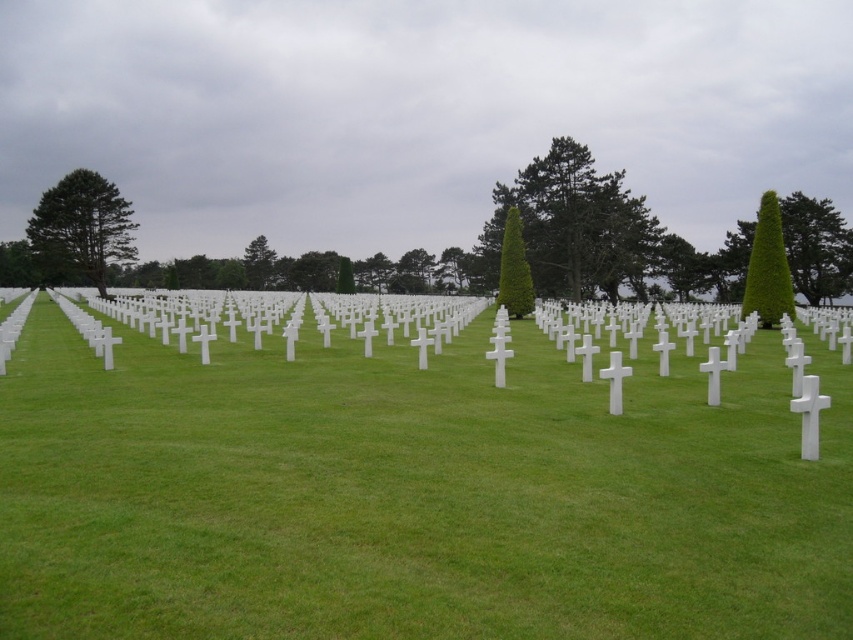
Is green textured pine tree at center wider than green leafy hedge at center?

Indeed, green textured pine tree at center has a greater width compared to green leafy hedge at center.

Does green textured pine tree at center have a greater height compared to green leafy hedge at center?

Indeed, green textured pine tree at center has a greater height compared to green leafy hedge at center.

Locate an element on the screen. The height and width of the screenshot is (640, 853). green textured pine tree at center is located at coordinates (573, 225).

Locate an element on the screen. This screenshot has height=640, width=853. green textured pine tree at center is located at coordinates (573, 225).

Can you confirm if green textured pine tree at left is bigger than green leafy tree at center?

Yes, green textured pine tree at left is bigger than green leafy tree at center.

Is green textured pine tree at left wider than green leafy tree at center?

Yes, green textured pine tree at left is wider than green leafy tree at center.

Which is behind, point (97, 179) or point (260, 275)?

Positioned behind is point (260, 275).

Find the location of `green textured pine tree at left`. green textured pine tree at left is located at coordinates (80, 228).

Can you confirm if green textured pine tree at left is positioned to the left of green leafy cone at center-right?

Yes, green textured pine tree at left is to the left of green leafy cone at center-right.

Is the position of green textured pine tree at left more distant than that of green leafy cone at center-right?

Yes, it is.

Image resolution: width=853 pixels, height=640 pixels. What do you see at coordinates (80, 228) in the screenshot? I see `green textured pine tree at left` at bounding box center [80, 228].

The image size is (853, 640). Identify the location of green textured pine tree at left. (80, 228).